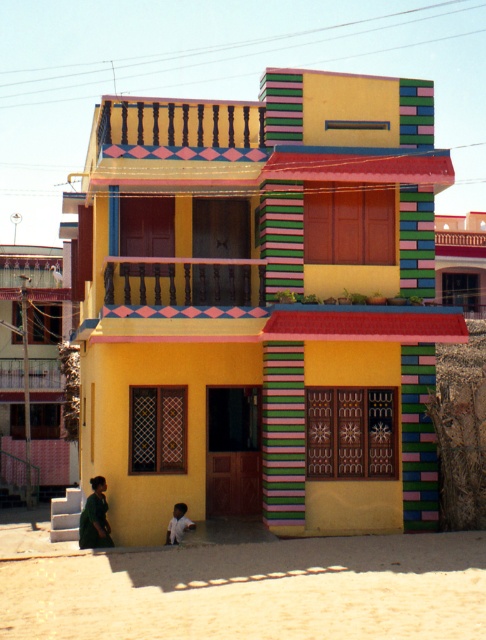
Which is above, beige sandy ground at lower center or green matte dress at lower left?

beige sandy ground at lower center is higher up.

At what (x,y) coordinates should I click in order to perform the action: click on beige sandy ground at lower center. Please return your answer as a coordinate pair (x, y). The height and width of the screenshot is (640, 486). Looking at the image, I should click on (255, 589).

Measure the distance from green matte dress at lower left to light blue fabric shirt at lower center.

They are 3.38 feet apart.

Is green matte dress at lower left to the right of light blue fabric shirt at lower center from the viewer's perspective?

No, green matte dress at lower left is not to the right of light blue fabric shirt at lower center.

Identify the location of green matte dress at lower left. The image size is (486, 640). (94, 516).

Based on the photo, can you confirm if beige sandy ground at lower center is smaller than light blue fabric shirt at lower center?

No.

Is beige sandy ground at lower center below light blue fabric shirt at lower center?

No, beige sandy ground at lower center is not below light blue fabric shirt at lower center.

Who is more distant from viewer, (451, 540) or (172, 522)?

Point (172, 522)

Locate an element on the screen. The image size is (486, 640). beige sandy ground at lower center is located at coordinates (255, 589).